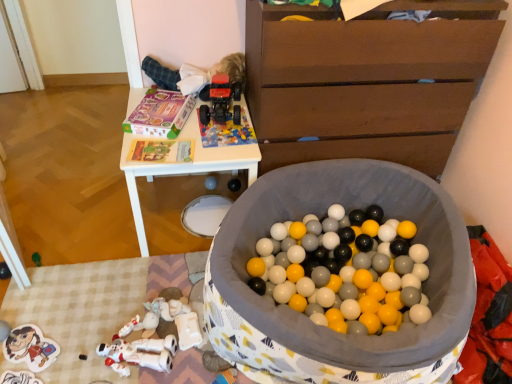
Locate an element on the screen. vacant space in front of fluffy white baby at upper center is located at coordinates (209, 134).